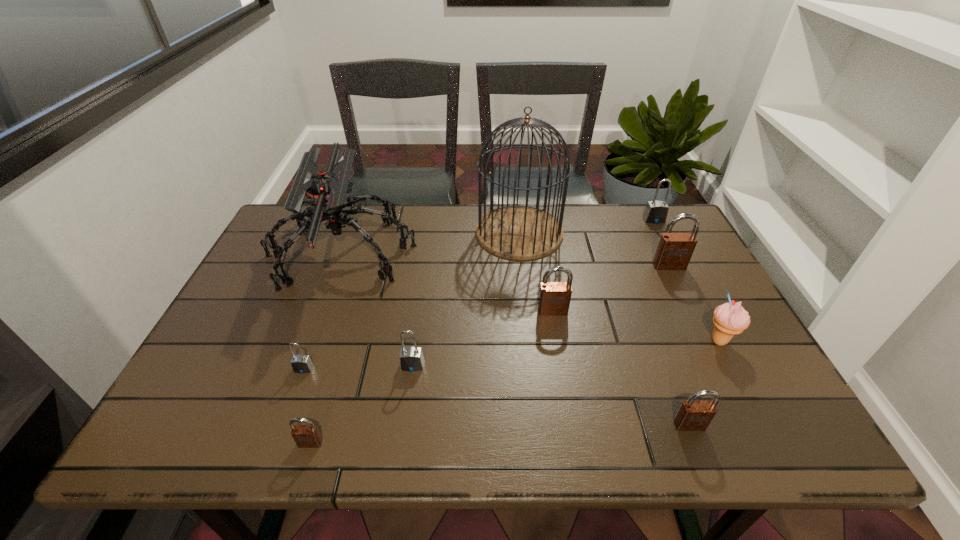
Where is `the fifth nearest object`? This screenshot has height=540, width=960. the fifth nearest object is located at coordinates (731, 318).

The height and width of the screenshot is (540, 960). I want to click on the seventh object from right to left, so click(x=411, y=359).

Locate an element on the screen. Image resolution: width=960 pixels, height=540 pixels. the third padlock from left to right is located at coordinates (411, 359).

The image size is (960, 540). I want to click on the second nearest padlock, so click(x=692, y=415).

Find the location of a particular element. The image size is (960, 540). the third farthest brown padlock is located at coordinates (692, 415).

Find the location of a particular element. The height and width of the screenshot is (540, 960). the leftmost gray padlock is located at coordinates (302, 363).

The height and width of the screenshot is (540, 960). In order to click on the smallest gray padlock in this screenshot , I will do `click(302, 363)`.

You are a GUI agent. You are given a task and a screenshot of the screen. Output one action in this format:
    pyautogui.click(x=<x>, y=<y>)
    Task: Click on the second padlock from left to right
    The width and height of the screenshot is (960, 540).
    Given the screenshot: What is the action you would take?
    pyautogui.click(x=305, y=436)

At what (x,y) coordinates should I click in order to perform the action: click on the smallest brown padlock. Please return your answer as a coordinate pair (x, y). Image resolution: width=960 pixels, height=540 pixels. Looking at the image, I should click on (305, 436).

Identify the location of free point located 0.050m at the door of the gray birdcage. (460, 232).